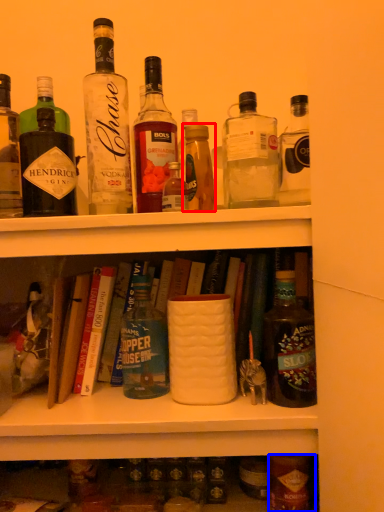
Question: Which of the following is the farthest to the observer, bottle (highlighted by a red box) or bottle (highlighted by a blue box)?

Choices:
 (A) bottle
 (B) bottle

Answer: (B)